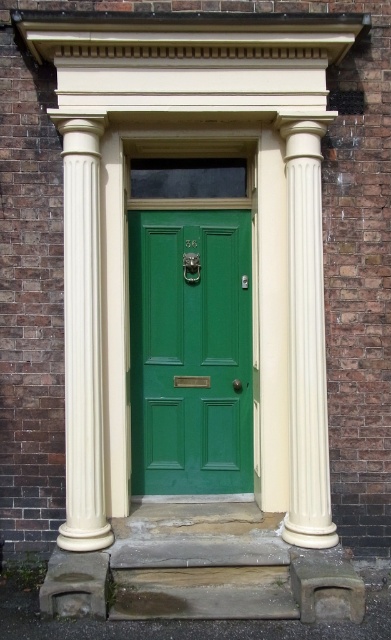
Question: Does creamy smooth column at left appear under creamy smooth column at right?

Choices:
 (A) no
 (B) yes

Answer: (B)

Question: Does creamy smooth column at left have a smaller size compared to creamy smooth column at right?

Choices:
 (A) yes
 (B) no

Answer: (A)

Question: Which object is positioned closest to the creamy smooth column at left?

Choices:
 (A) creamy smooth column at right
 (B) green matte door at center

Answer: (B)

Question: Which object is closer to the camera taking this photo?

Choices:
 (A) green matte door at center
 (B) creamy smooth column at left

Answer: (B)

Question: Does green matte door at center appear on the right side of creamy smooth column at right?

Choices:
 (A) yes
 (B) no

Answer: (B)

Question: Among these points, which one is farthest from the camera?

Choices:
 (A) (148, 250)
 (B) (84, 218)

Answer: (A)